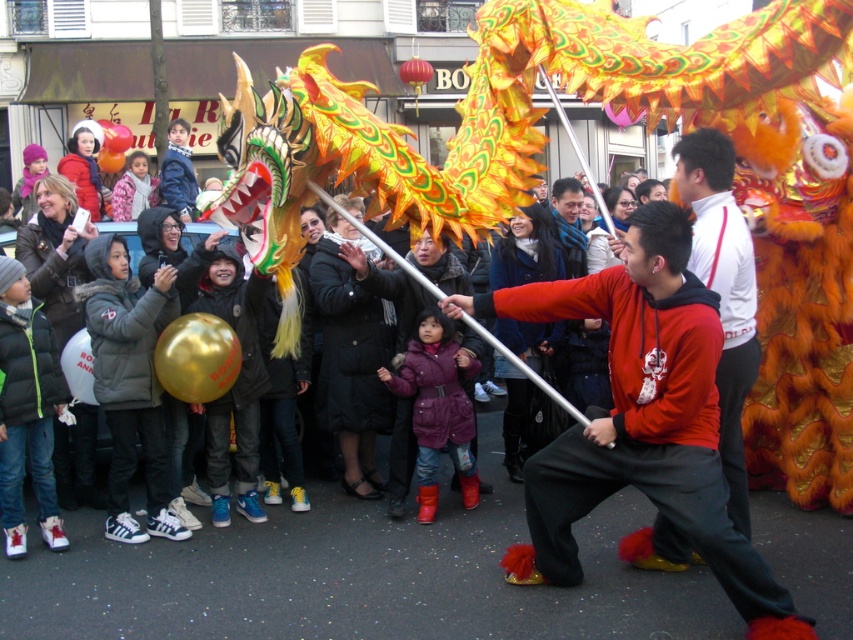
Consider the image. Can you confirm if matte red sweatshirt at center is positioned to the left of red hoodie at center?

Yes, matte red sweatshirt at center is to the left of red hoodie at center.

Is point (619, 308) farther from camera compared to point (722, 148)?

No, it is in front of (722, 148).

This screenshot has height=640, width=853. I want to click on matte red sweatshirt at center, so click(641, 419).